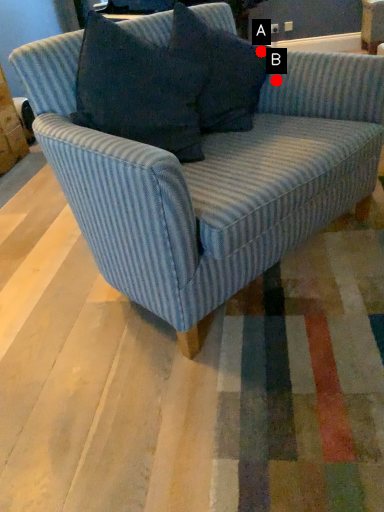
Question: Two points are circled on the image, labeled by A and B beside each circle. Which point is farther from the camera taking this photo?

Choices:
 (A) A is further
 (B) B is further

Answer: (B)